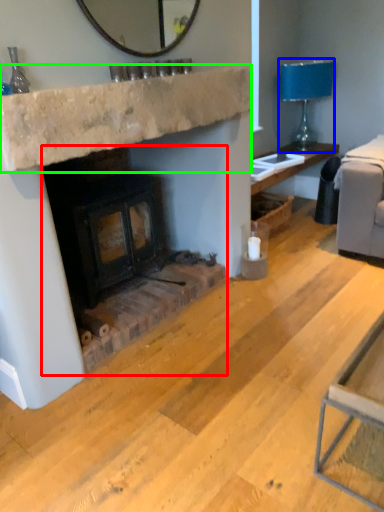
Question: Which object is positioned closest to wood burning stove (highlighted by a red box)? Select from lamp (highlighted by a blue box) and counter top (highlighted by a green box).

Choices:
 (A) lamp
 (B) counter top

Answer: (B)